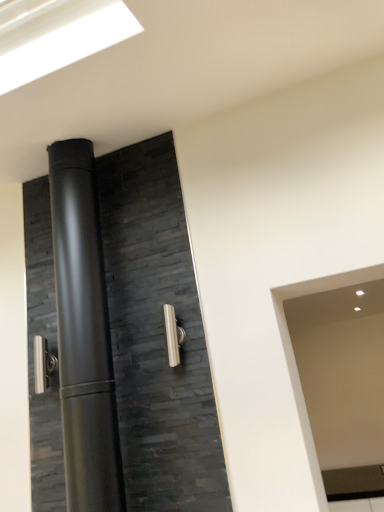
What do you see at coordinates (157, 336) in the screenshot? I see `matte black door at center` at bounding box center [157, 336].

Describe the element at coordinates (43, 364) in the screenshot. The width and height of the screenshot is (384, 512). I see `satin nickel door handle at left, the second door handle from the front` at that location.

What are the coordinates of `satin nickel door handle at left, the second door handle from the front` in the screenshot? It's located at (43, 364).

The image size is (384, 512). I want to click on matte black door at center, so click(157, 336).

From the image's perspective, is matte black door at center above or below satin nickel door handle at center, arranged as the second door handle when viewed from the left?

Clearly, from the image's perspective, matte black door at center is above satin nickel door handle at center, arranged as the second door handle when viewed from the left.

Considering the relative positions of matte black door at center and satin nickel door handle at center, arranged as the second door handle when viewed from the left, in the image provided, is matte black door at center behind satin nickel door handle at center, arranged as the second door handle when viewed from the left,?

No, matte black door at center is closer to the camera.

Is point (208, 466) more distant than point (169, 315)?

That is False.

From a real-world perspective, which object rests below the other?

satin nickel door handle at left, the second door handle from the front, is physically lower.

Is satin nickel door handle at left, placed as the first door handle when sorted from left to right, facing away from matte black door at center?

No, satin nickel door handle at left, placed as the first door handle when sorted from left to right,'s orientation is not away from matte black door at center.

From the image's perspective, starting from the matte black door at center, which door handle is the 2nd one below? Please provide its 2D coordinates.

[(43, 364)]

Who is bigger, satin nickel door handle at left, the 1th door handle when ordered from back to front, or matte black door at center?

matte black door at center.

Is satin nickel door handle at center, arranged as the second door handle when viewed from the left, a part of satin nickel door handle at left, which appears as the second door handle when viewed from the right?

No, satin nickel door handle at left, which appears as the second door handle when viewed from the right, does not contain satin nickel door handle at center, arranged as the second door handle when viewed from the left.

How different are the orientations of satin nickel door handle at left, the 1th door handle when ordered from back to front, and satin nickel door handle at center, which is the 1th door handle from front to back, in degrees?

There is a 0.929-degree angle between the facing directions of satin nickel door handle at left, the 1th door handle when ordered from back to front, and satin nickel door handle at center, which is the 1th door handle from front to back.

Between satin nickel door handle at left, the 1th door handle when ordered from back to front, and satin nickel door handle at center, placed as the 2th door handle when sorted from back to front, which one has more height?

satin nickel door handle at center, placed as the 2th door handle when sorted from back to front.

Considering the sizes of objects satin nickel door handle at left, the second door handle from the front, and satin nickel door handle at center, arranged as the second door handle when viewed from the left, in the image provided, who is thinner, satin nickel door handle at left, the second door handle from the front, or satin nickel door handle at center, arranged as the second door handle when viewed from the left,?

Thinner between the two is satin nickel door handle at center, arranged as the second door handle when viewed from the left.

Is satin nickel door handle at center, placed as the 2th door handle when sorted from back to front, outside of satin nickel door handle at left, which appears as the second door handle when viewed from the right?

Yes, satin nickel door handle at center, placed as the 2th door handle when sorted from back to front, is located beyond the bounds of satin nickel door handle at left, which appears as the second door handle when viewed from the right.

Measure the distance between satin nickel door handle at center, placed as the 2th door handle when sorted from back to front, and satin nickel door handle at left, the 1th door handle when ordered from back to front.

satin nickel door handle at center, placed as the 2th door handle when sorted from back to front, and satin nickel door handle at left, the 1th door handle when ordered from back to front, are 63.11 centimeters apart.

Which point is more forward, (171, 322) or (46, 349)?

The point (171, 322) is closer to the camera.

From a real-world perspective, is satin nickel door handle at center, arranged as the second door handle when viewed from the left, under satin nickel door handle at left, which appears as the second door handle when viewed from the right?

Yes, from a real-world perspective, satin nickel door handle at center, arranged as the second door handle when viewed from the left, is beneath satin nickel door handle at left, which appears as the second door handle when viewed from the right.

Is matte black door at center touching satin nickel door handle at left, the 1th door handle when ordered from back to front?

matte black door at center and satin nickel door handle at left, the 1th door handle when ordered from back to front, are clearly separated.

Is matte black door at center looking in the opposite direction of satin nickel door handle at left, placed as the first door handle when sorted from left to right?

Correct, matte black door at center is looking away from satin nickel door handle at left, placed as the first door handle when sorted from left to right.

From the image's perspective, which is above, matte black door at center or satin nickel door handle at left, the second door handle from the front?

matte black door at center is shown above in the image.

Looking at their sizes, would you say matte black door at center is wider or thinner than satin nickel door handle at left, the second door handle from the front?

matte black door at center is wider than satin nickel door handle at left, the second door handle from the front.

Would you consider satin nickel door handle at center, placed as the 2th door handle when sorted from back to front, to be distant from matte black door at center?

satin nickel door handle at center, placed as the 2th door handle when sorted from back to front, is actually quite close to matte black door at center.

Is matte black door at center at the back of satin nickel door handle at center, placed as the 2th door handle when sorted from back to front?

No, satin nickel door handle at center, placed as the 2th door handle when sorted from back to front, is not facing away from matte black door at center.

Does satin nickel door handle at center, which is the 1th door handle from front to back, have a smaller size compared to matte black door at center?

Correct, satin nickel door handle at center, which is the 1th door handle from front to back, occupies less space than matte black door at center.

Does satin nickel door handle at center, arranged as the second door handle when viewed from the left, have a lesser height compared to matte black door at center?

Yes, satin nickel door handle at center, arranged as the second door handle when viewed from the left, is shorter than matte black door at center.

This screenshot has height=512, width=384. Identify the location of door on the left of satin nickel door handle at center, the 1th door handle positioned from the right. (157, 336).

The height and width of the screenshot is (512, 384). I want to click on door handle that is the 2nd object located behind the matte black door at center, so click(x=43, y=364).

Estimate the real-world distances between objects in this image. Which object is further from matte black door at center, satin nickel door handle at left, the 1th door handle when ordered from back to front, or satin nickel door handle at center, which is the 1th door handle from front to back?

satin nickel door handle at left, the 1th door handle when ordered from back to front.

Based on their spatial positions, is matte black door at center or satin nickel door handle at center, which is the 1th door handle from front to back, closer to satin nickel door handle at left, the second door handle from the front?

Based on the image, matte black door at center appears to be nearer to satin nickel door handle at left, the second door handle from the front.

Considering their positions, is satin nickel door handle at left, placed as the first door handle when sorted from left to right, positioned closer to satin nickel door handle at center, placed as the 2th door handle when sorted from back to front, than matte black door at center?

matte black door at center is positioned closer to the anchor satin nickel door handle at center, placed as the 2th door handle when sorted from back to front.

From the image, which object appears to be farther from satin nickel door handle at left, which appears as the second door handle when viewed from the right, satin nickel door handle at center, the 1th door handle positioned from the right, or matte black door at center?

The object further to satin nickel door handle at left, which appears as the second door handle when viewed from the right, is satin nickel door handle at center, the 1th door handle positioned from the right.

When comparing their distances from satin nickel door handle at center, arranged as the second door handle when viewed from the left, does matte black door at center or satin nickel door handle at left, placed as the first door handle when sorted from left to right, seem further?

Based on the image, satin nickel door handle at left, placed as the first door handle when sorted from left to right, appears to be further to satin nickel door handle at center, arranged as the second door handle when viewed from the left.

From the image, which object appears to be nearer to matte black door at center, satin nickel door handle at center, placed as the 2th door handle when sorted from back to front, or satin nickel door handle at left, the second door handle from the front?

satin nickel door handle at center, placed as the 2th door handle when sorted from back to front, is positioned closer to the anchor matte black door at center.

The width and height of the screenshot is (384, 512). I want to click on door handle between matte black door at center and satin nickel door handle at left, which appears as the second door handle when viewed from the right, in the front-back direction, so click(x=173, y=335).